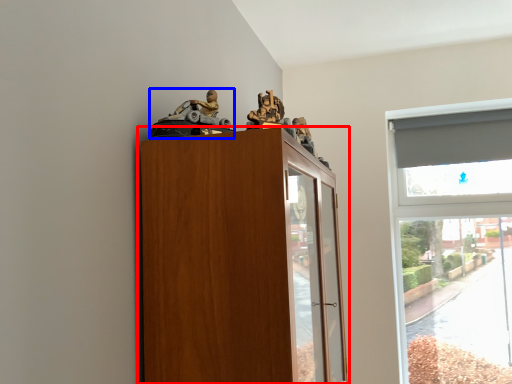
Question: Among these objects, which one is farthest to the camera, cupboard (highlighted by a red box) or toy (highlighted by a blue box)?

Choices:
 (A) cupboard
 (B) toy

Answer: (B)